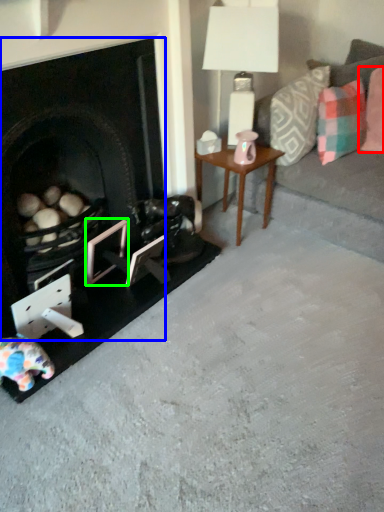
Question: Which object is the farthest from pillow (highlighted by a red box)? Choose among these: fireplace (highlighted by a blue box) or picture frame (highlighted by a green box).

Choices:
 (A) fireplace
 (B) picture frame

Answer: (B)